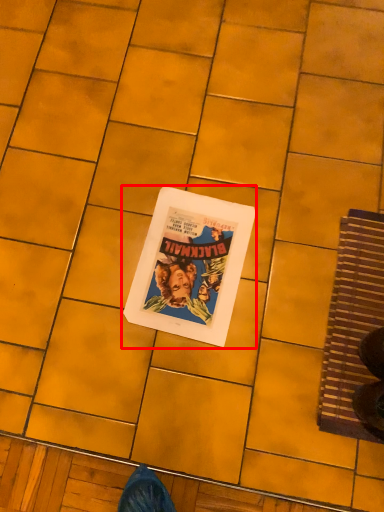
Question: From the image's perspective, what is the correct spatial positioning of paperback book (annotated by the red box) in reference to doormat?

Choices:
 (A) above
 (B) below

Answer: (A)